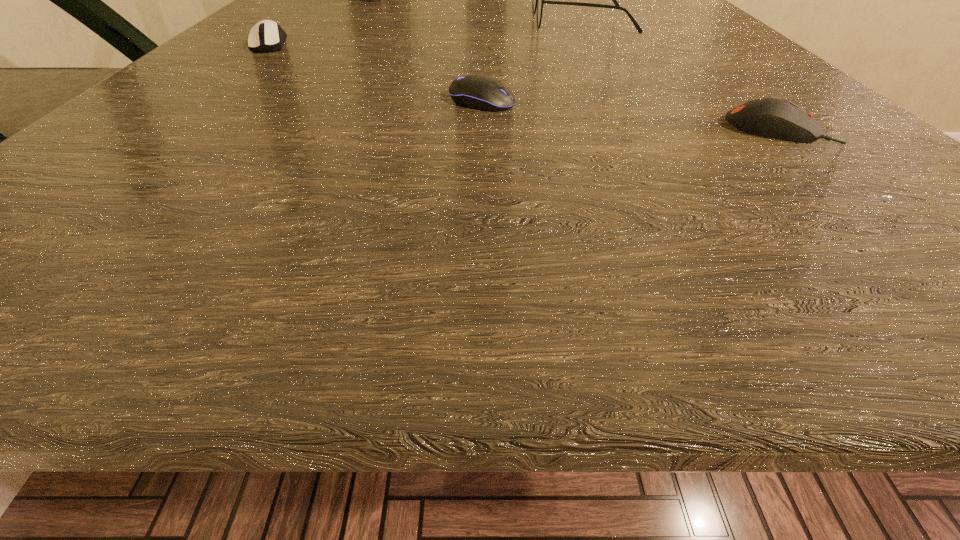
Locate an element on the screen. Image resolution: width=960 pixels, height=540 pixels. blank space located 0.240m on the front-facing side of the second tallest object is located at coordinates (399, 21).

I want to click on vacant area situated on the right of the leftmost computer mouse, so click(x=347, y=45).

The image size is (960, 540). What are the coordinates of `vacant space positioned on the left of the nearest object` in the screenshot? It's located at (617, 130).

The image size is (960, 540). I want to click on vacant point located 0.210m on the right of the third object from right to left, so click(689, 102).

Identify the location of object at the far edge. The height and width of the screenshot is (540, 960). (538, 0).

This screenshot has height=540, width=960. What are the coordinates of `object located at the left edge` in the screenshot? It's located at (270, 36).

Find the location of `spectacles that is at the right edge`. spectacles that is at the right edge is located at coordinates (538, 0).

The height and width of the screenshot is (540, 960). Identify the location of computer mouse that is at the right edge. (768, 117).

The width and height of the screenshot is (960, 540). I want to click on object at the far right corner, so click(538, 0).

At what (x,y) coordinates should I click in order to perform the action: click on free space at the far edge of the desktop. Please return your answer as a coordinate pair (x, y). The height and width of the screenshot is (540, 960). Looking at the image, I should click on (565, 18).